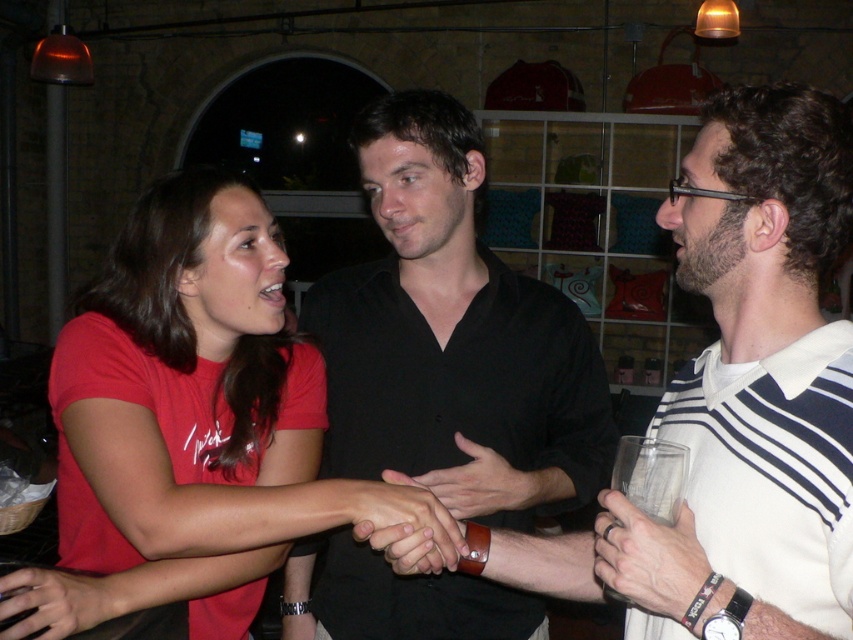
Question: Is matte red shirt at lower left positioned at the back of matte black hand at center?

Choices:
 (A) no
 (B) yes

Answer: (A)

Question: Which point is farther to the camera?

Choices:
 (A) smooth leather wristband at lower right
 (B) black leather shirt at center

Answer: (A)

Question: Estimate the real-world distances between objects in this image. Which object is closer to the matte red shirt at lower left?

Choices:
 (A) matte red t-shirt at center
 (B) black matte shirt at center

Answer: (A)

Question: Can you confirm if smooth leather wristband at lower right is positioned to the left of matte red shirt at lower left?

Choices:
 (A) no
 (B) yes

Answer: (A)

Question: Which of the following is the farthest from the observer?

Choices:
 (A) (625, 540)
 (B) (729, 204)

Answer: (B)

Question: From the image, what is the correct spatial relationship of black leather shirt at center in relation to matte black hand at center?

Choices:
 (A) below
 (B) above

Answer: (B)